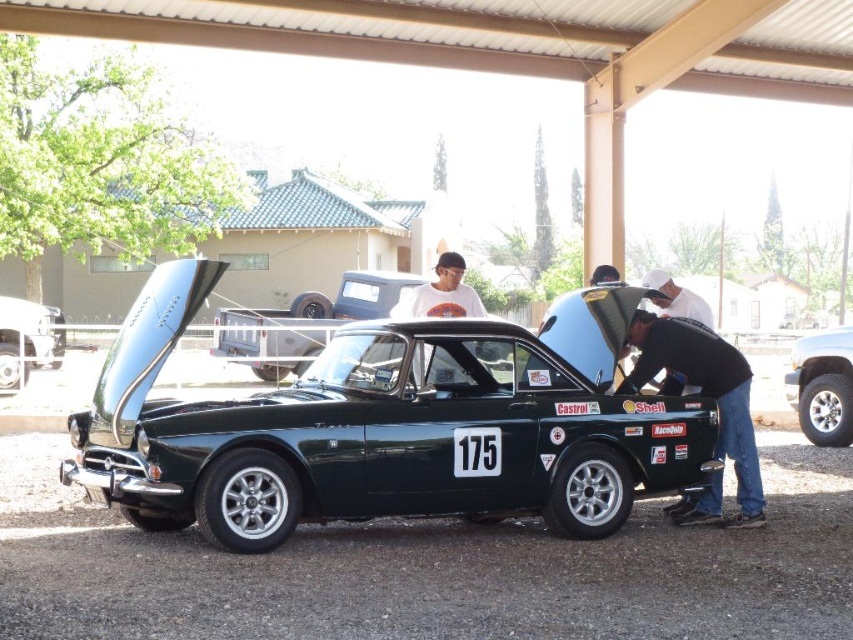
Question: Which object appears farthest from the camera in this image?

Choices:
 (A) shiny silver car at center
 (B) white cotton shirt at upper center
 (C) shiny dark green car at center

Answer: (A)

Question: Which point is farther to the camera?

Choices:
 (A) shiny dark green car at center
 (B) black matte shirt at lower right
 (C) shiny silver car at center

Answer: (C)

Question: Does black matte shirt at lower right have a lesser width compared to silver metallic tire at lower right?

Choices:
 (A) yes
 (B) no

Answer: (B)

Question: Can you confirm if black matte shirt at lower right is positioned to the left of white cotton shirt at upper center?

Choices:
 (A) no
 (B) yes

Answer: (A)

Question: Which point is closer to the camera taking this photo?

Choices:
 (A) (647, 333)
 (B) (468, 291)

Answer: (A)

Question: Is silver metallic tire at lower right closer to camera compared to white cotton shirt at upper center?

Choices:
 (A) no
 (B) yes

Answer: (A)